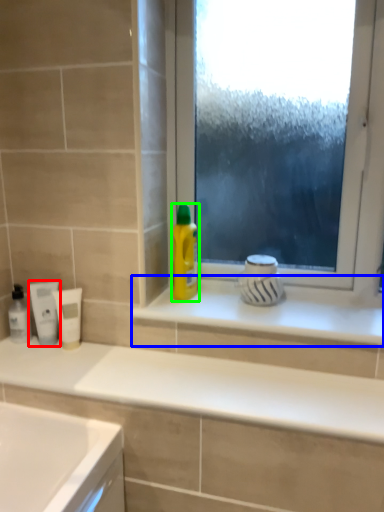
Question: Based on their relative distances, which object is nearer to mouthwash (highlighted by a red box)? Choose from window sill (highlighted by a blue box) and cleaning product (highlighted by a green box).

Choices:
 (A) window sill
 (B) cleaning product

Answer: (B)